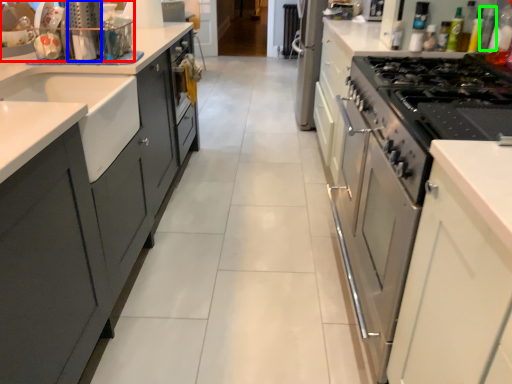
Question: Which is farther away from kitchen appliance (highlighted by a red box)? appliance (highlighted by a blue box) or bottle (highlighted by a green box)?

Choices:
 (A) appliance
 (B) bottle

Answer: (B)